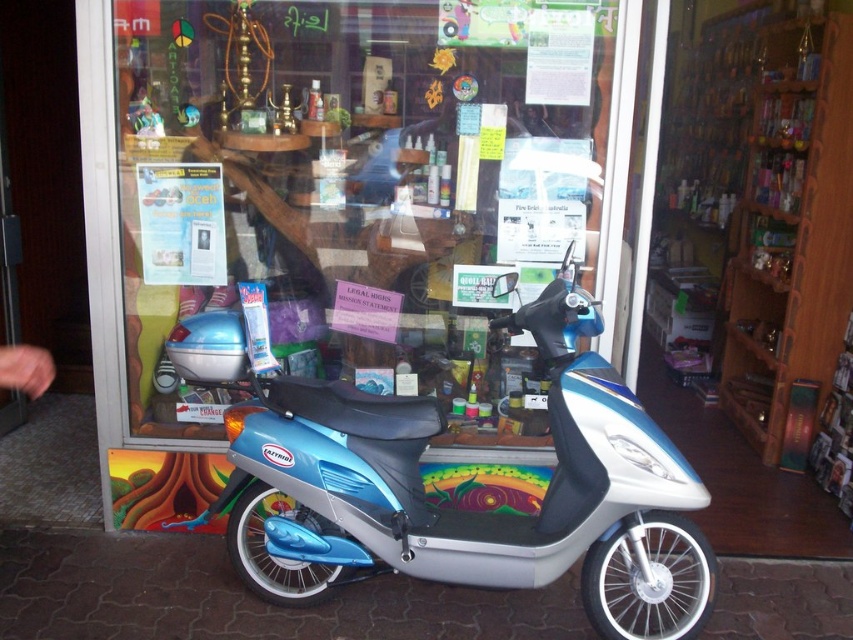
Question: Which point is farther to the camera?

Choices:
 (A) pos(613,371)
 (B) pos(612,200)

Answer: (B)

Question: Among these points, which one is farthest from the camera?

Choices:
 (A) (550, 161)
 (B) (564, 358)

Answer: (A)

Question: Which point is farther to the camera?

Choices:
 (A) transparent glass door at center
 (B) metallic blue scooter at center

Answer: (A)

Question: Observing the image, what is the correct spatial positioning of transparent glass door at center in reference to metallic blue scooter at center?

Choices:
 (A) below
 (B) above

Answer: (B)

Question: Does transparent glass door at center lie in front of metallic blue scooter at center?

Choices:
 (A) yes
 (B) no

Answer: (B)

Question: Does transparent glass door at center appear on the left side of metallic blue scooter at center?

Choices:
 (A) yes
 (B) no

Answer: (A)